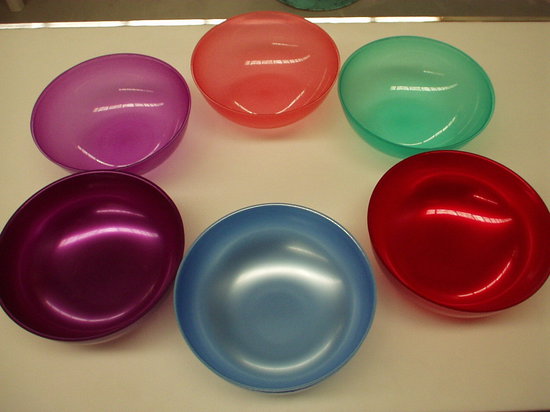
Locate an element on the screen. The height and width of the screenshot is (412, 550). red bowl is located at coordinates (438, 273).